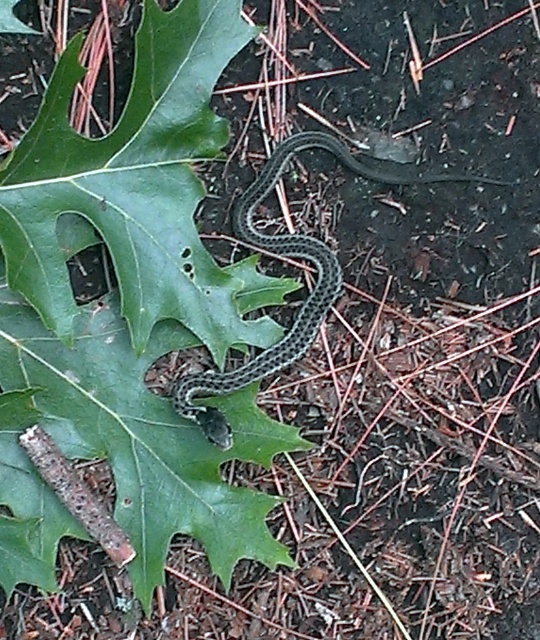
You are a photographer trying to capture a detailed shot of the green matte leaf at center. Your camera is set to focus at 4 feet. Will the leaf be in focus?

The green matte leaf at center is 4.37 feet from the camera, which is slightly beyond the 4 feet focus setting. Therefore, the leaf may not be in focus unless the camera has a sufficient depth of field to cover the distance difference.

Based on the photo, what is the 2D coordinate of the green matte leaf at center?

The green matte leaf at center is located at the 2D coordinate point of (139, 292).